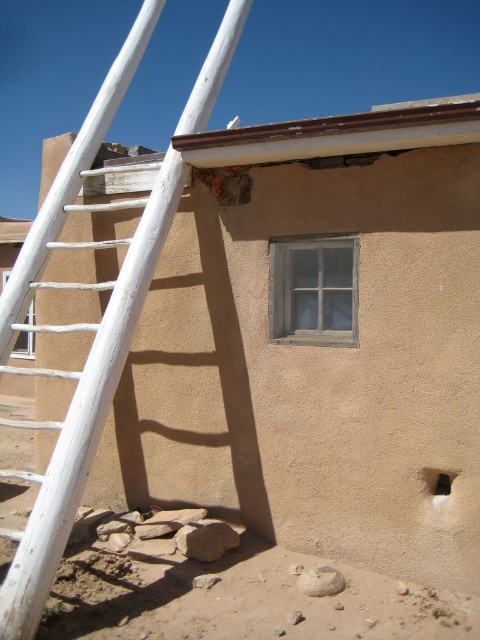
Which is more to the left, white wooden ladder at left or clear glass window at lower left?

From the viewer's perspective, clear glass window at lower left appears more on the left side.

Does white wooden ladder at left have a larger size compared to clear glass window at lower left?

Incorrect, white wooden ladder at left is not larger than clear glass window at lower left.

Who is more distant from viewer, [132,317] or [27,333]?

The point [27,333] is behind.

The height and width of the screenshot is (640, 480). In order to click on white wooden ladder at left in this screenshot , I will do `click(86, 413)`.

Between black matte hole at lower right and clear glass window at lower left, which one appears on the left side from the viewer's perspective?

From the viewer's perspective, clear glass window at lower left appears more on the left side.

Find the location of a particular element. The image size is (480, 640). black matte hole at lower right is located at coordinates pyautogui.click(x=437, y=483).

The width and height of the screenshot is (480, 640). What do you see at coordinates (86, 413) in the screenshot? I see `white wooden ladder at left` at bounding box center [86, 413].

In the scene shown: Can you confirm if white wooden ladder at left is bigger than black matte hole at lower right?

Indeed, white wooden ladder at left has a larger size compared to black matte hole at lower right.

What are the coordinates of `white wooden ladder at left` in the screenshot? It's located at (86, 413).